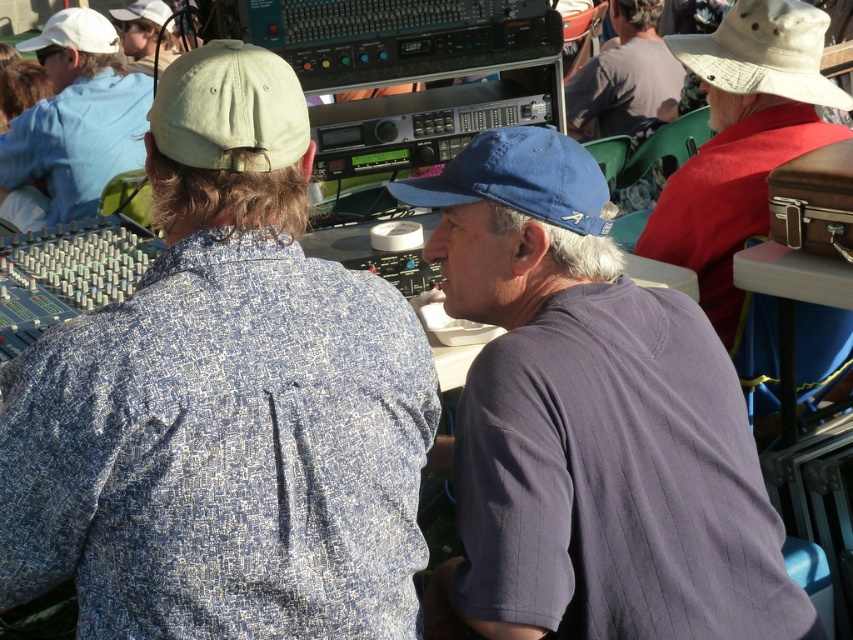
You are a photographer at the event and want to capture a clear photo of the blue textured shirt at center and the khaki fabric baseball hat at upper right. Which object should you focus on first to ensure both are in focus?

The blue textured shirt at center is in front of the khaki fabric baseball hat at upper right, so you should focus on the blue textured shirt at center first to ensure both are in focus.

You are a photographer trying to capture a candid shot of the two people at the event. You notice the blue textured shirt at center and the khaki fabric baseball hat at upper right in your viewfinder. Which object should you adjust your focus to ensure the subject with the wider part is in frame?

The blue textured shirt at center is wider than the khaki fabric baseball hat at upper right, so you should focus on the blue textured shirt at center to ensure the wider part is in frame.

You are a photographer at the event and want to take a clear photo of both the light gray fabric baseball cap at upper left and the white fabric baseball cap at upper left. Since they are both in the upper left area, which one is closer to the camera?

The light gray fabric baseball cap at upper left is in front of the white fabric baseball cap at upper left, so it is closer to the camera.